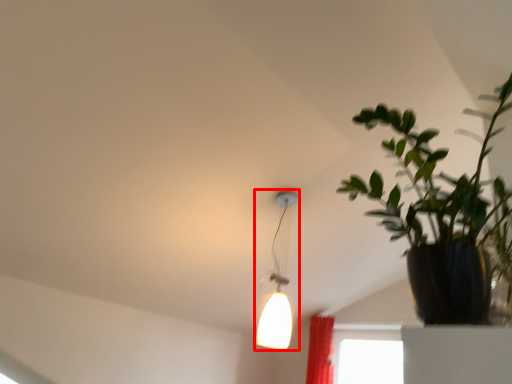
Question: From the image's perspective, where is lamp (annotated by the red box) located relative to houseplant?

Choices:
 (A) above
 (B) below

Answer: (B)